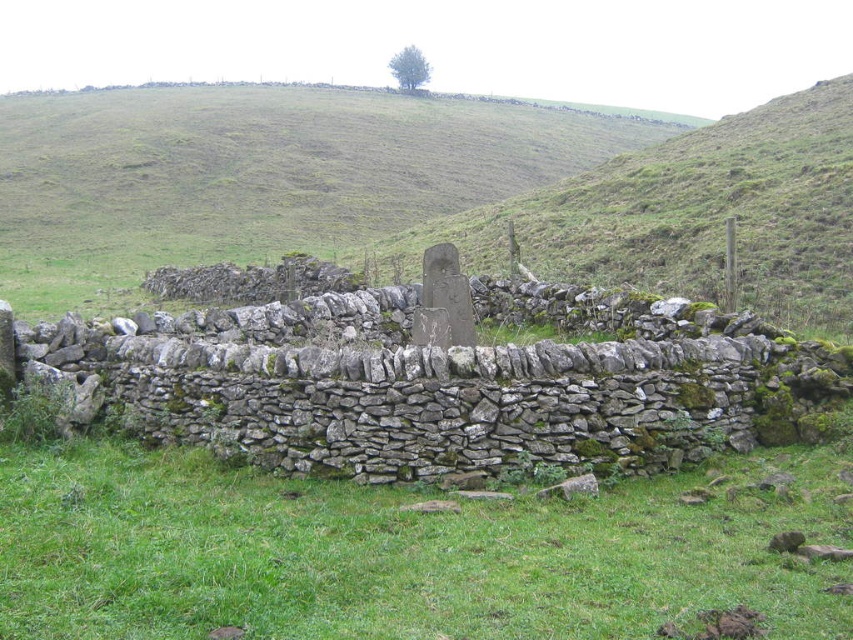
Consider the image. Can you confirm if green grassy hillside at center is wider than green grassy at center?

Yes.

Who is positioned more to the left, green grassy hillside at center or green grassy at center?

green grassy hillside at center

What do you see at coordinates (447, 188) in the screenshot?
I see `green grassy hillside at center` at bounding box center [447, 188].

You are a GUI agent. You are given a task and a screenshot of the screen. Output one action in this format:
    pyautogui.click(x=<x>, y=<y>)
    Task: Click on the green grassy hillside at center
    Image resolution: width=853 pixels, height=640 pixels.
    Given the screenshot: What is the action you would take?
    (x=447, y=188)